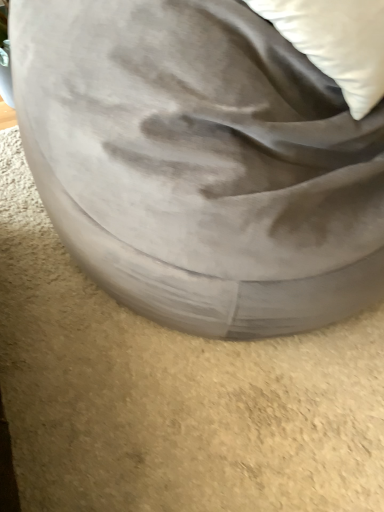
The height and width of the screenshot is (512, 384). What do you see at coordinates (200, 163) in the screenshot? I see `velvet gray bean bag at center` at bounding box center [200, 163].

Locate an element on the screen. This screenshot has width=384, height=512. velvet gray bean bag at center is located at coordinates (200, 163).

Identify the location of velvet gray bean bag at center. (200, 163).